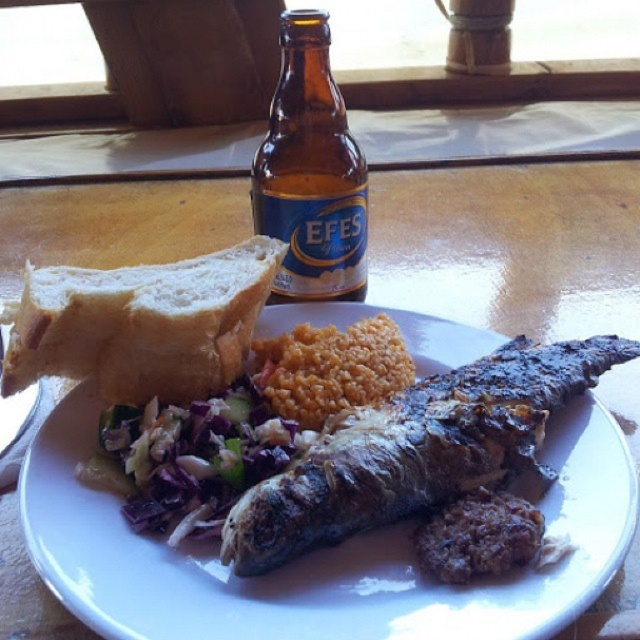
Can you confirm if white soft bread at upper left is thinner than brown glass bottle at upper center?

In fact, white soft bread at upper left might be wider than brown glass bottle at upper center.

Consider the image. Which is below, white soft bread at upper left or brown glass bottle at upper center?

white soft bread at upper left

Does point (81, 352) come farther from viewer compared to point (333, 282)?

No.

Locate an element on the screen. white soft bread at upper left is located at coordinates point(141,323).

Which is above, white soft bread at upper left or brown rice at center?

white soft bread at upper left is above.

Where is `white soft bread at upper left`? white soft bread at upper left is located at coordinates (141, 323).

Which is behind, point (240, 364) or point (310, 397)?

Point (240, 364)

The height and width of the screenshot is (640, 640). I want to click on white soft bread at upper left, so click(141, 323).

Is point (112, 426) closer to camera compared to point (326, 346)?

Yes, point (112, 426) is in front of point (326, 346).

Is point (164, 444) positioned behind point (305, 420)?

No, it is in front of (305, 420).

What do you see at coordinates (192, 458) in the screenshot? I see `shredded purple cabbage at center` at bounding box center [192, 458].

You are a GUI agent. You are given a task and a screenshot of the screen. Output one action in this format:
    pyautogui.click(x=<x>, y=<y>)
    Task: Click on the shredded purple cabbage at center
    
    Given the screenshot: What is the action you would take?
    pyautogui.click(x=192, y=458)